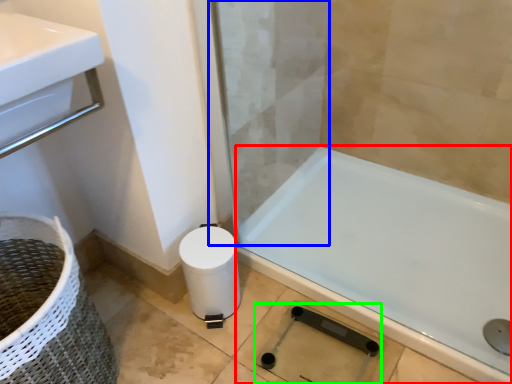
Question: Estimate the real-world distances between objects in this image. Which object is farther from bathtub (highlighted by a red box), screen door (highlighted by a blue box) or shower (highlighted by a green box)?

Choices:
 (A) screen door
 (B) shower

Answer: (A)